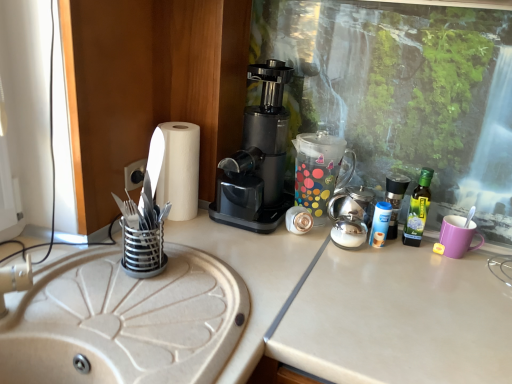
Question: Is black plastic socket at center-left not near beige matte sink at left?

Choices:
 (A) no
 (B) yes

Answer: (A)

Question: Does black plastic socket at center-left have a lesser width compared to beige matte sink at left?

Choices:
 (A) yes
 (B) no

Answer: (A)

Question: Is black plastic socket at center-left wider than beige matte sink at left?

Choices:
 (A) no
 (B) yes

Answer: (A)

Question: Is black plastic socket at center-left closer to camera compared to beige matte sink at left?

Choices:
 (A) yes
 (B) no

Answer: (B)

Question: From the image's perspective, is black plastic socket at center-left above beige matte sink at left?

Choices:
 (A) yes
 (B) no

Answer: (A)

Question: Does black plastic socket at center-left turn towards beige matte sink at left?

Choices:
 (A) no
 (B) yes

Answer: (A)

Question: From the image's perspective, is white paper towel at left over beige matte sink at left?

Choices:
 (A) yes
 (B) no

Answer: (A)

Question: Is white paper towel at left directly adjacent to beige matte sink at left?

Choices:
 (A) yes
 (B) no

Answer: (B)

Question: From a real-world perspective, is white paper towel at left located higher than beige matte sink at left?

Choices:
 (A) no
 (B) yes

Answer: (B)

Question: From the image's perspective, does white paper towel at left appear lower than beige matte sink at left?

Choices:
 (A) yes
 (B) no

Answer: (B)

Question: Is white paper towel at left closer to the viewer compared to beige matte sink at left?

Choices:
 (A) no
 (B) yes

Answer: (A)

Question: Does white paper towel at left have a lesser width compared to beige matte sink at left?

Choices:
 (A) no
 (B) yes

Answer: (B)

Question: Is blue plastic bottle at right, which appears as the second bottle when viewed from the right, closer to camera compared to black plastic coffee maker at center?

Choices:
 (A) no
 (B) yes

Answer: (A)